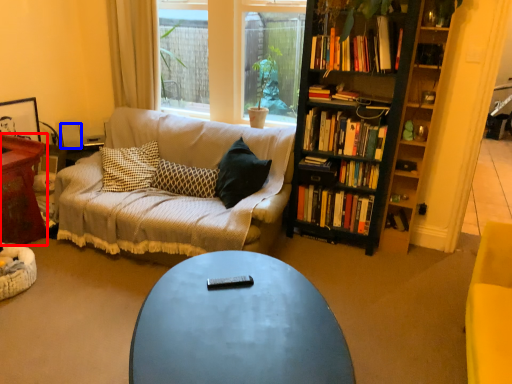
Question: Which of the following is the closest to the observer, table (highlighted by a red box) or loudspeaker (highlighted by a blue box)?

Choices:
 (A) table
 (B) loudspeaker

Answer: (A)